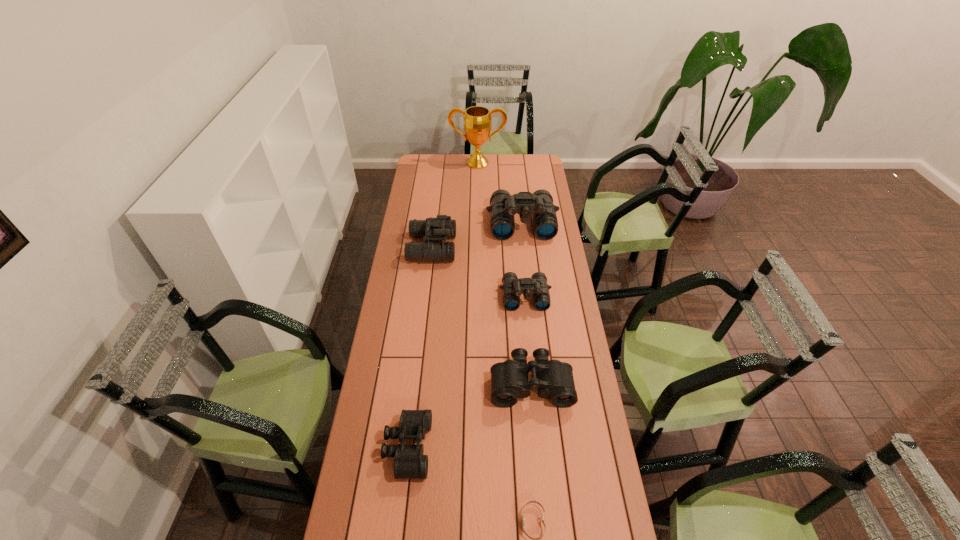
I want to click on the smaller black binoculars, so click(410, 463).

You are a GUI agent. You are given a task and a screenshot of the screen. Output one action in this format:
    pyautogui.click(x=<x>, y=<y>)
    Task: Click on the left black binoculars
    This screenshot has width=960, height=540.
    Given the screenshot: What is the action you would take?
    pyautogui.click(x=410, y=463)

Find the location of a particular element. The width and height of the screenshot is (960, 540). vacant space located on the front-facing side of the gold award is located at coordinates (477, 177).

In order to click on blank space located through the lenses of the tallest binoculars in this screenshot , I will do `click(528, 283)`.

Where is `free space located through the lenses of the second tallest binoculars`? The height and width of the screenshot is (540, 960). free space located through the lenses of the second tallest binoculars is located at coordinates (471, 248).

Where is `vacant region located through the lenses of the fourth farthest object`? This screenshot has width=960, height=540. vacant region located through the lenses of the fourth farthest object is located at coordinates (535, 394).

The height and width of the screenshot is (540, 960). I want to click on free space located 0.260m at the eyepieces of the farther black binoculars, so point(540,484).

You are a GUI agent. You are given a task and a screenshot of the screen. Output one action in this format:
    pyautogui.click(x=<x>, y=<y>)
    Task: Click on the blank space located at the eyepieces of the second nearest object
    
    Given the screenshot: What is the action you would take?
    pyautogui.click(x=506, y=448)

Image resolution: width=960 pixels, height=540 pixels. I want to click on object located in the far edge section of the desktop, so click(x=477, y=122).

In the image, there is a desktop. At what (x,y) coordinates should I click in order to perform the action: click on vacant region at the far edge. Please return your answer as a coordinate pair (x, y). This screenshot has height=540, width=960. Looking at the image, I should click on (445, 162).